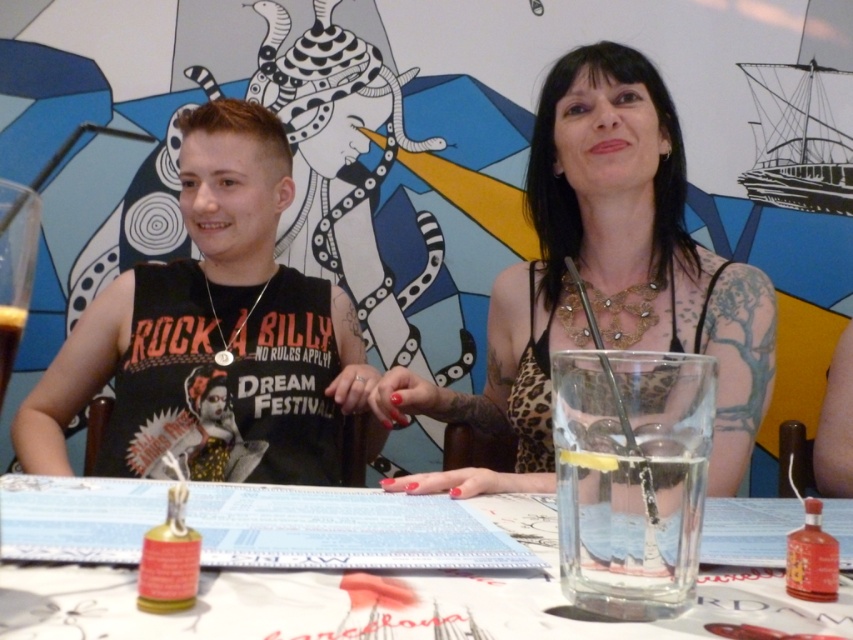
You are at the table and want to place a small vase between the two points, point (96, 353) and point (662, 156). Which point should the vase be closer to if it needs to be placed in front of the other?

The vase should be closer to point (662, 156) because point (96, 353) is behind point (662, 156), so placing it closer to the front point ensures it is in front of the other.

You are a fashion designer observing the image. You need to decide whether the black matte tank top at left can fit into a display case designed for items narrower than the clear plastic glass at center. Can it fit?

The black matte tank top at left is narrower than the clear plastic glass at center, so it can fit into the display case designed for items narrower than the clear plastic glass at center.